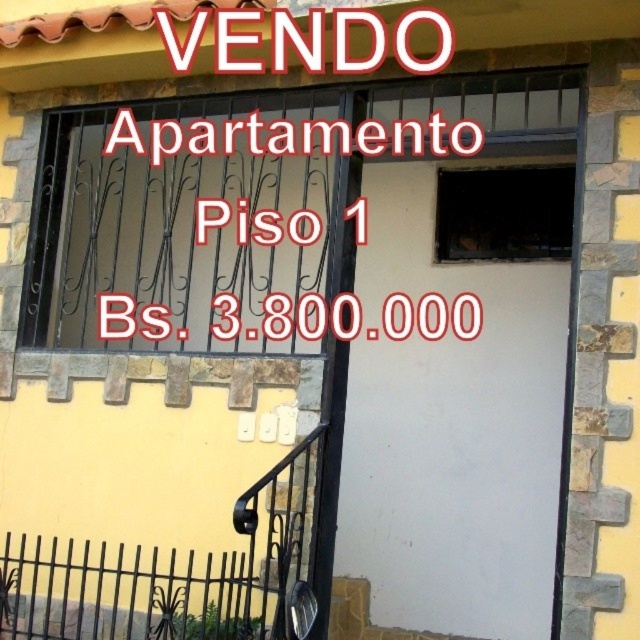
You are a delivery person trying to deliver a package to the apartment. The entrance has a white matte door at center and a white matte sign at upper center. Which object is taller?

The white matte door at center is taller than the white matte sign at upper center.

You are a real estate agent who needs to enter the apartment for a showing. The entrance has a white matte door at center and a white matte sign at upper center. Which object should you approach first to gain access?

You should approach the white matte door at center first to gain access because it is positioned under the white matte sign at upper center, meaning it is located below the sign and likely the entrance point.